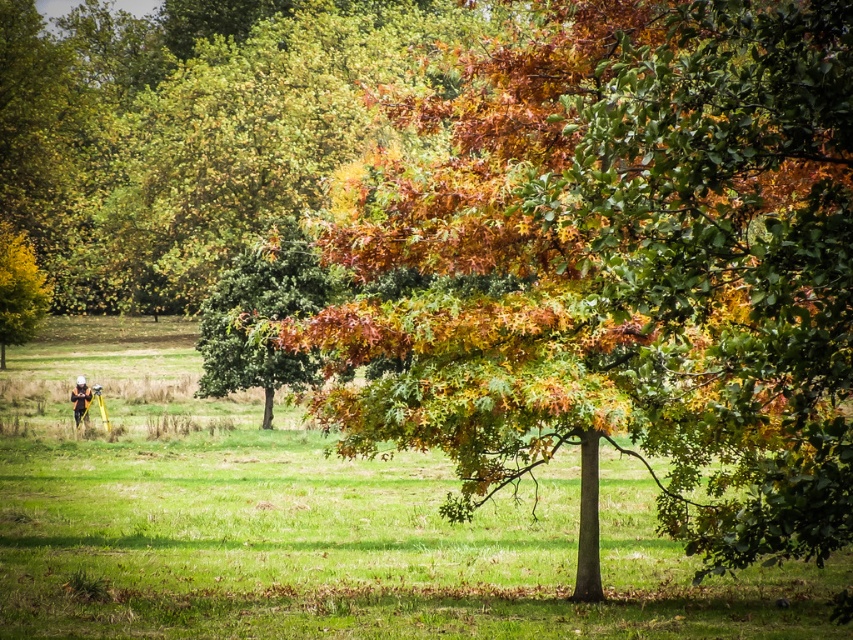
Which of these two, golden yellow leaves at left or orange-clothed person at lower left, stands shorter?

Standing shorter between the two is orange-clothed person at lower left.

Which is in front, point (10, 336) or point (71, 396)?

Point (71, 396)

Locate an element on the screen. golden yellow leaves at left is located at coordinates (18, 291).

Between point (584, 195) and point (271, 276), which one is positioned in front?

Point (584, 195)

Does multicolored foliage at center appear on the right side of green leafy tree at center?

Indeed, multicolored foliage at center is positioned on the right side of green leafy tree at center.

Which is in front, point (549, 84) or point (270, 288)?

Positioned in front is point (549, 84).

Identify the location of multicolored foliage at center. The width and height of the screenshot is (853, 640). (624, 269).

Can you confirm if green leafy tree at center is shorter than golden yellow leaves at left?

Answer: Yes.

Who is lower down, green leafy tree at center or golden yellow leaves at left?

green leafy tree at center is below.

Image resolution: width=853 pixels, height=640 pixels. Find the location of `green leafy tree at center`. green leafy tree at center is located at coordinates (263, 316).

Where is `green leafy tree at center`? green leafy tree at center is located at coordinates (263, 316).